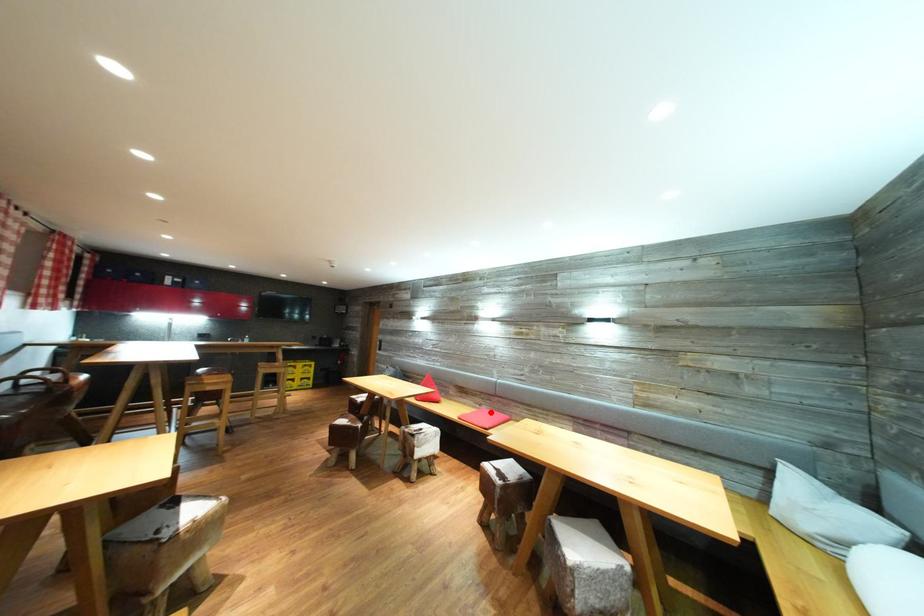
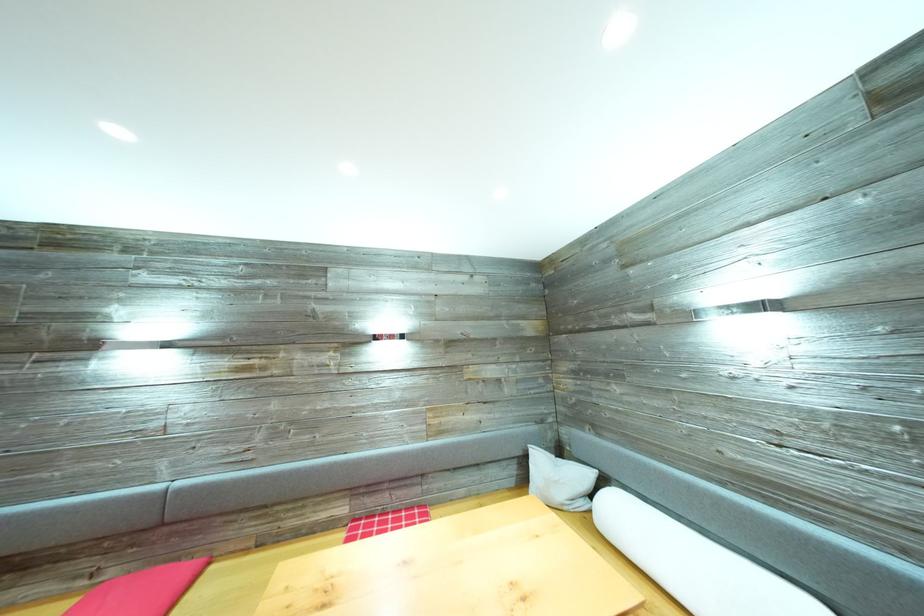
The point at the highlighted location is marked in the first image. Where is the corresponding point in the second image?

(117, 578)